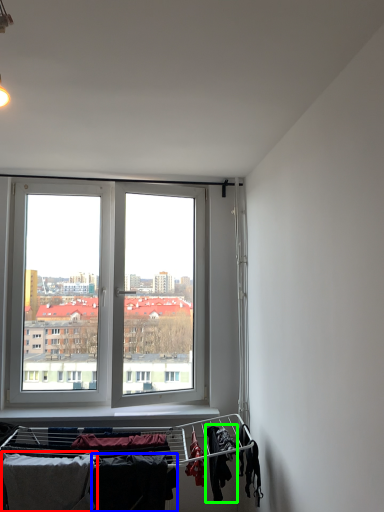
Question: Which object is positioned closest to clothing (highlighted by a red box)? Select from clothing (highlighted by a blue box) and clothing (highlighted by a green box).

Choices:
 (A) clothing
 (B) clothing

Answer: (A)